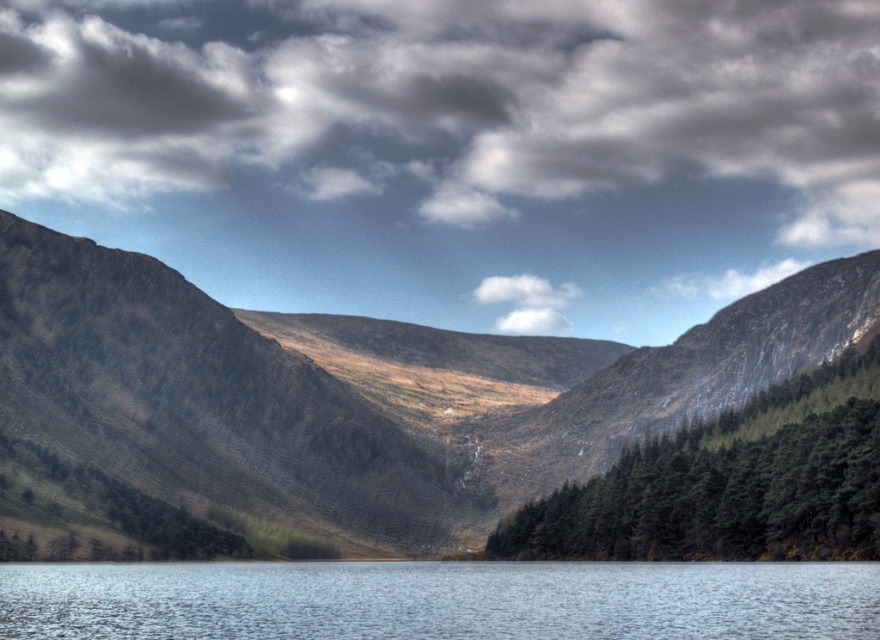
Between point (559, 573) and point (859, 454), which one is positioned behind?

Positioned behind is point (859, 454).

Between transparent water at center and green matte trees at center, which one has less height?

transparent water at center is shorter.

Is point (292, 637) positioned behind point (590, 496)?

No, it is not.

You are a GUI agent. You are given a task and a screenshot of the screen. Output one action in this format:
    pyautogui.click(x=<x>, y=<y>)
    Task: Click on the transparent water at center
    
    Given the screenshot: What is the action you would take?
    pyautogui.click(x=440, y=600)

Is rugged stone mountain at center below transparent water at center?

No.

Is rugged stone mountain at center above transparent water at center?

Yes.

Is point (522, 385) less distant than point (664, 602)?

No, (522, 385) is behind (664, 602).

Find the location of a particular element. The image size is (880, 640). rugged stone mountain at center is located at coordinates (363, 390).

What do you see at coordinates (363, 390) in the screenshot? Image resolution: width=880 pixels, height=640 pixels. I see `rugged stone mountain at center` at bounding box center [363, 390].

Between rugged stone mountain at center and green matte trees at center, which one has more height?

rugged stone mountain at center

Is point (284, 339) more distant than point (819, 468)?

Yes, point (284, 339) is farther from viewer.

The image size is (880, 640). I want to click on rugged stone mountain at center, so [363, 390].